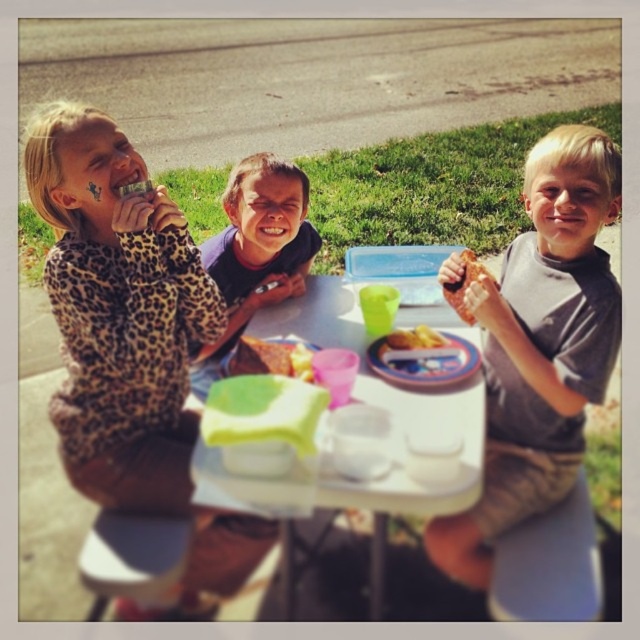
Question: Estimate the real-world distances between objects in this image. Which object is farther from the leopard print shirt at upper left?

Choices:
 (A) brown crumbly bread at right
 (B) gray/white t-shirt at right
 (C) purple soft shirt at center

Answer: (A)

Question: Is purple soft shirt at center to the right of yellow matte cake at center from the viewer's perspective?

Choices:
 (A) no
 (B) yes

Answer: (A)

Question: Which of these objects is positioned farthest from the leopard print shirt at upper left?

Choices:
 (A) gray/white t-shirt at right
 (B) white plastic tray at center
 (C) yellow matte cake at center

Answer: (A)

Question: Which object is closer to the camera taking this photo?

Choices:
 (A) gray/white t-shirt at right
 (B) leopard print shirt at upper left
 (C) purple soft shirt at center
 (D) brown crumbly bread at right

Answer: (B)

Question: Is leopard print shirt at upper left in front of white plastic tray at center?

Choices:
 (A) yes
 (B) no

Answer: (B)

Question: Is gray/white t-shirt at right in front of white plastic tray at center?

Choices:
 (A) yes
 (B) no

Answer: (B)